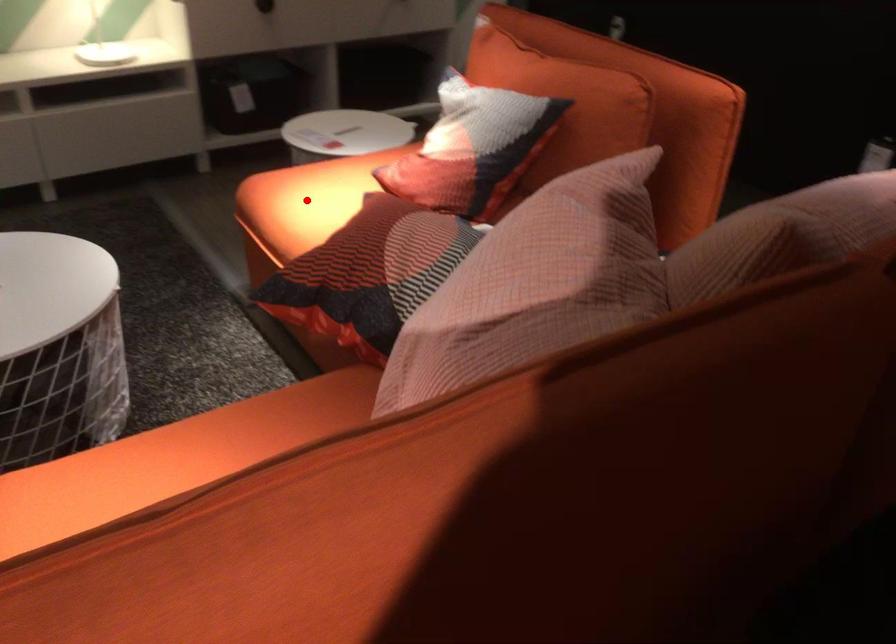
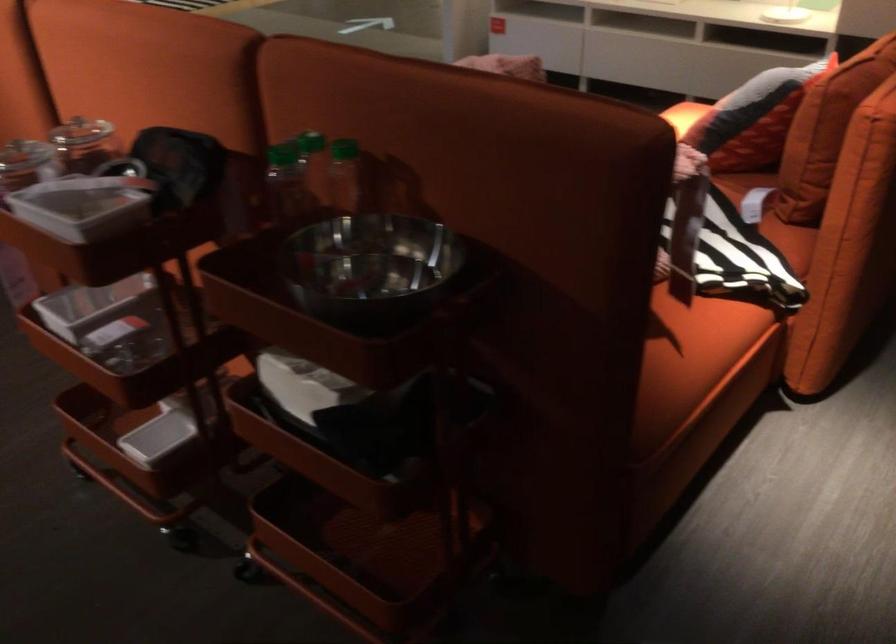
Question: I am providing you with two images of the same scene from different viewpoints. A red point is marked on the first image. Is the red point's position out of view in image 2?

Choices:
 (A) Yes
 (B) No

Answer: (A)